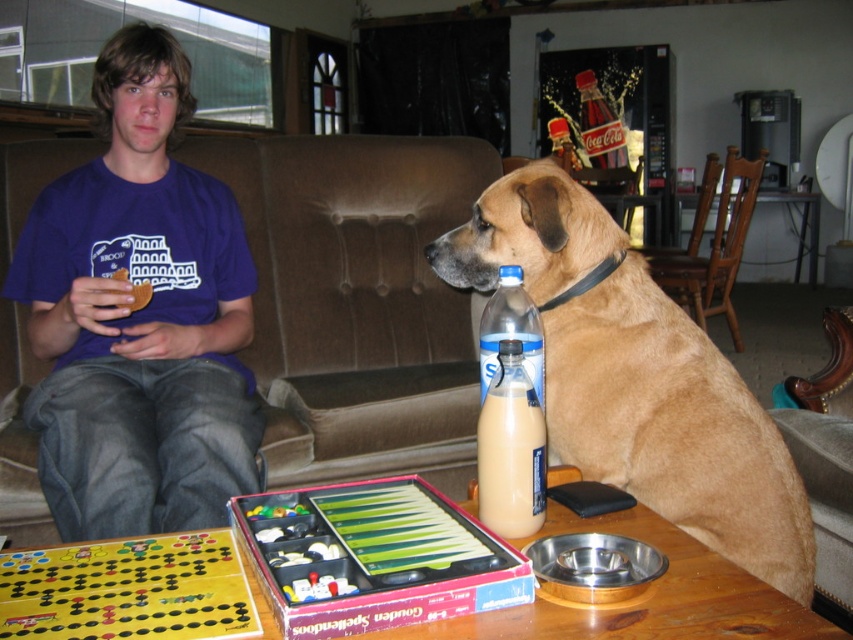
You are standing at the origin point of the coordinate system in the image. You need to walk to point A at point (131, 474) and point B at point (676, 492). Which point will you reach first?

Point B at point (676, 492) will be reached first because point A at point (131, 474) is behind it.

You are standing in the room and see the point at coordinates (138, 317). What object is located at that point?

The point at coordinates (138, 317) corresponds to the blue tshirt at center.